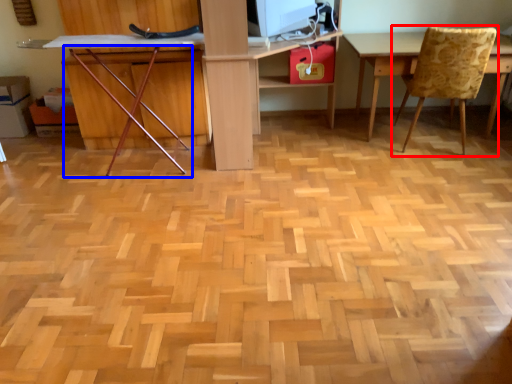
Question: Which object appears closest to the camera in this image, chair (highlighted by a red box) or chair (highlighted by a blue box)?

Choices:
 (A) chair
 (B) chair

Answer: (B)